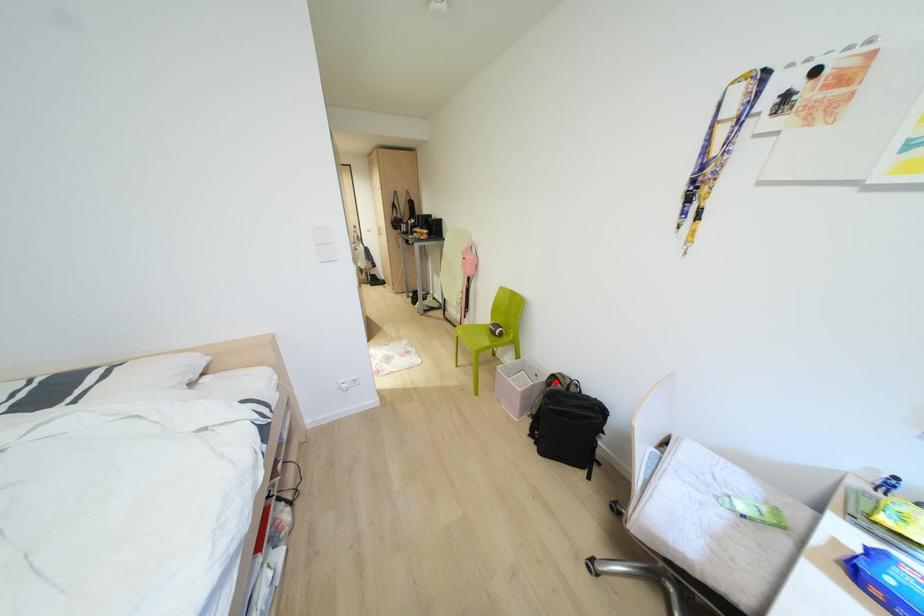
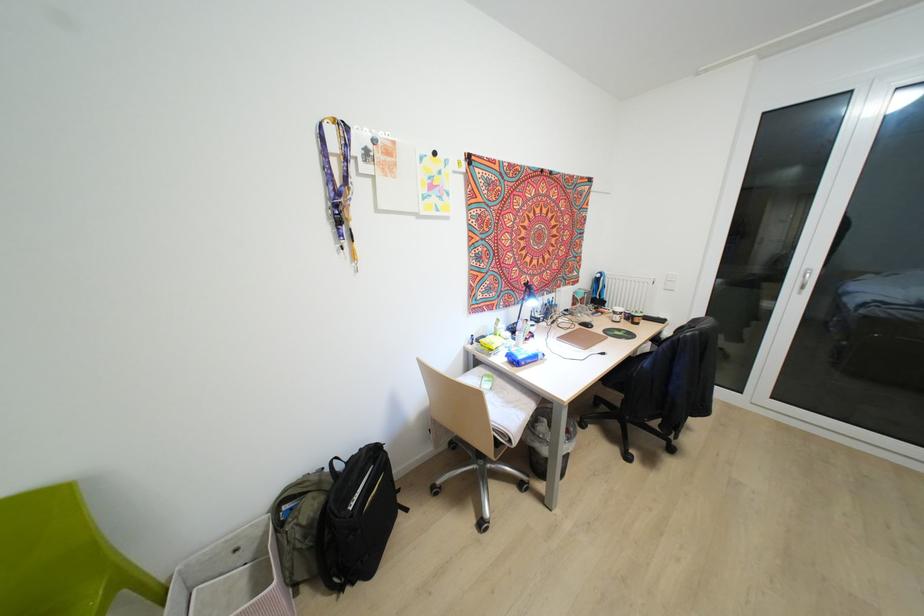
Question: I am providing you with two images of the same scene from different viewpoints. A red point is shown in image1. For the corresponding object point in image2, is it positioned nearer or farther from the camera?

Choices:
 (A) Nearer
 (B) Farther

Answer: (B)